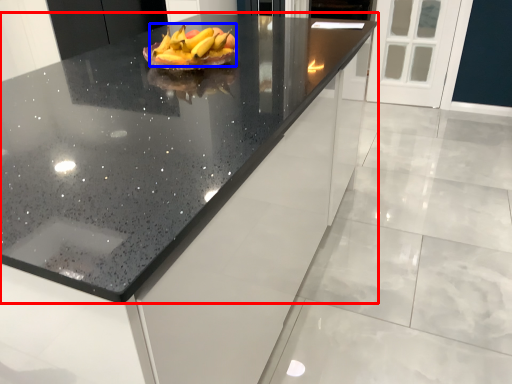
Question: Which object is further to the camera taking this photo, countertop (highlighted by a red box) or grapefruit (highlighted by a blue box)?

Choices:
 (A) countertop
 (B) grapefruit

Answer: (B)